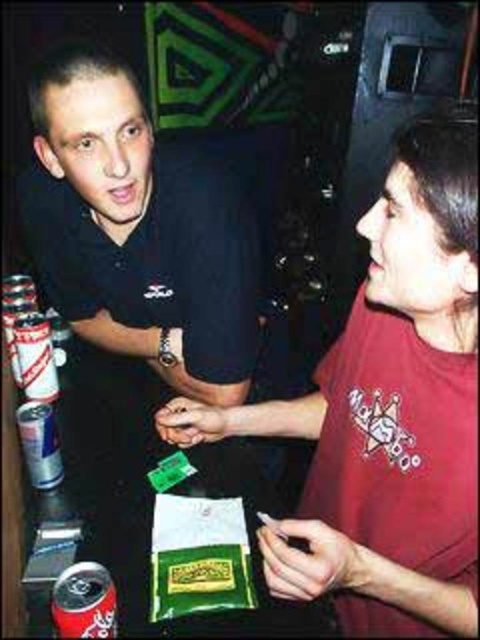
You are a bartender at the venue and need to place a new soda can on the counter between the red matte shirt at right and the red matte soda can at lower left. Which object should you position closer to the edge of the counter to ensure the soda can fits properly?

The red matte soda can at lower left is shorter than the red matte shirt at right. To ensure the soda can fits properly, position the red matte shirt at right closer to the edge of the counter since it is taller and requires more space.

You are at a bar and see two cans on the left side of the scene. The white cardboard can at left and the silver metallic can at left. Which can is taller?

The white cardboard can at left is much taller than the silver metallic can at left according to the description.

You are a security guard at a venue and notice a point at coordinates (387,412). What object is located at that point?

The point at coordinates (387,412) indicates the red matte shirt at right.